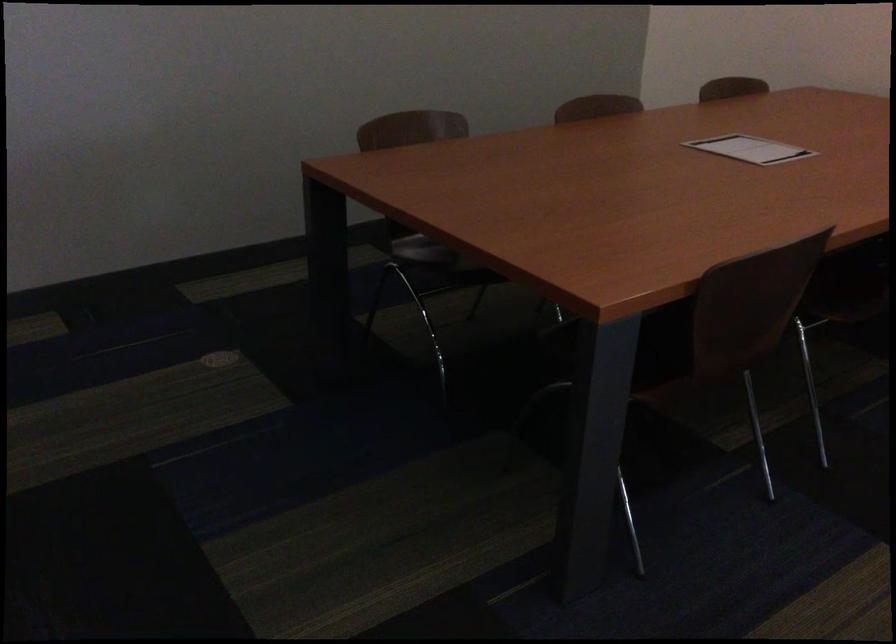
Image resolution: width=896 pixels, height=644 pixels. What do you see at coordinates (710, 357) in the screenshot?
I see `a brown chair sitting surface` at bounding box center [710, 357].